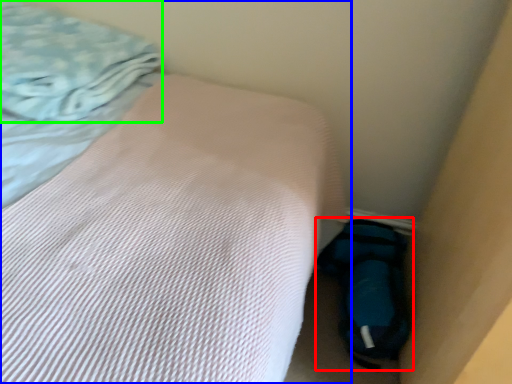
Question: Based on their relative distances, which object is farther from sleeping bag (highlighted by a red box)? Choose from bed (highlighted by a blue box) and blanket (highlighted by a green box).

Choices:
 (A) bed
 (B) blanket

Answer: (B)